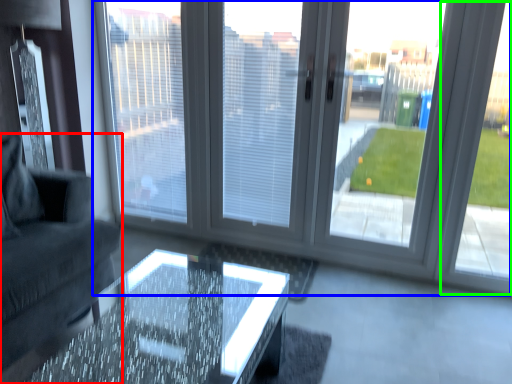
Question: Considering the real-world distances, which object is closest to studio couch (highlighted by a red box)? window (highlighted by a blue box) or window frame (highlighted by a green box).

Choices:
 (A) window
 (B) window frame

Answer: (A)